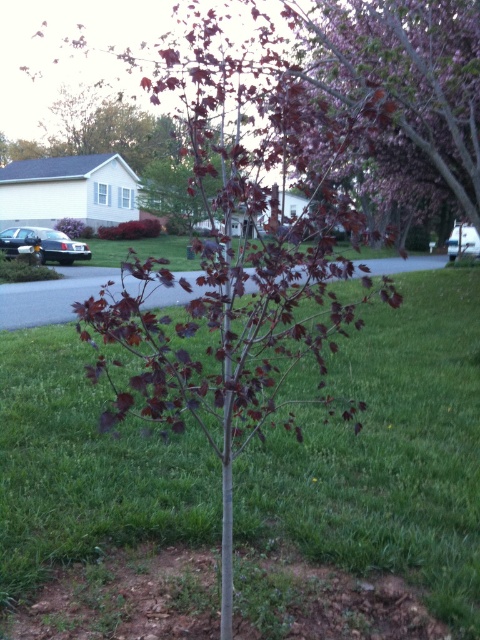
You are standing in front of the young tree with reddish purple leaves. There are two points marked in the image, point 1 at coordinates point (148, 442) and point 2 at coordinates point (469, 77). Which point is closer to you?

Point (148, 442) is closer to the viewer than point (469, 77).

You are standing at the origin point of the image. Which direction should you move to reach the green grass at center?

The green grass at center is located at the 2D coordinates of point (388, 452), so you should move towards the right and downward from the origin point to reach it.